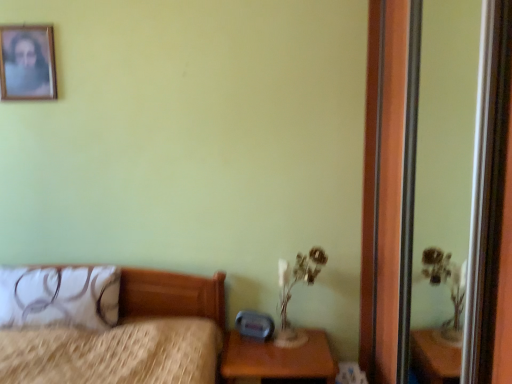
Question: Is transparent glass screen door at right positioned behind white fabric pillow at left?

Choices:
 (A) no
 (B) yes

Answer: (A)

Question: Would you say transparent glass screen door at right is a long distance from white fabric pillow at left?

Choices:
 (A) yes
 (B) no

Answer: (A)

Question: Considering the relative sizes of transparent glass screen door at right and white fabric pillow at left in the image provided, is transparent glass screen door at right shorter than white fabric pillow at left?

Choices:
 (A) no
 (B) yes

Answer: (A)

Question: Can you confirm if transparent glass screen door at right is smaller than white fabric pillow at left?

Choices:
 (A) no
 (B) yes

Answer: (A)

Question: Does transparent glass screen door at right have a lesser width compared to white fabric pillow at left?

Choices:
 (A) yes
 (B) no

Answer: (A)

Question: Is transparent glass screen door at right aimed at white fabric pillow at left?

Choices:
 (A) yes
 (B) no

Answer: (A)

Question: From a real-world perspective, is translucent glass table lamp at lower right positioned over brown wooden nightstand at lower right based on gravity?

Choices:
 (A) yes
 (B) no

Answer: (A)

Question: From the image's perspective, is translucent glass table lamp at lower right above brown wooden nightstand at lower right?

Choices:
 (A) yes
 (B) no

Answer: (A)

Question: Considering the relative positions of translucent glass table lamp at lower right and brown wooden nightstand at lower right in the image provided, is translucent glass table lamp at lower right in front of brown wooden nightstand at lower right?

Choices:
 (A) yes
 (B) no

Answer: (B)

Question: Is brown wooden nightstand at lower right located within translucent glass table lamp at lower right?

Choices:
 (A) no
 (B) yes

Answer: (A)

Question: Is translucent glass table lamp at lower right smaller than brown wooden nightstand at lower right?

Choices:
 (A) yes
 (B) no

Answer: (A)

Question: Is translucent glass table lamp at lower right at the left side of brown wooden nightstand at lower right?

Choices:
 (A) no
 (B) yes

Answer: (A)

Question: From the image's perspective, is wooden picture frame at upper left beneath translucent glass table lamp at lower right?

Choices:
 (A) yes
 (B) no

Answer: (B)